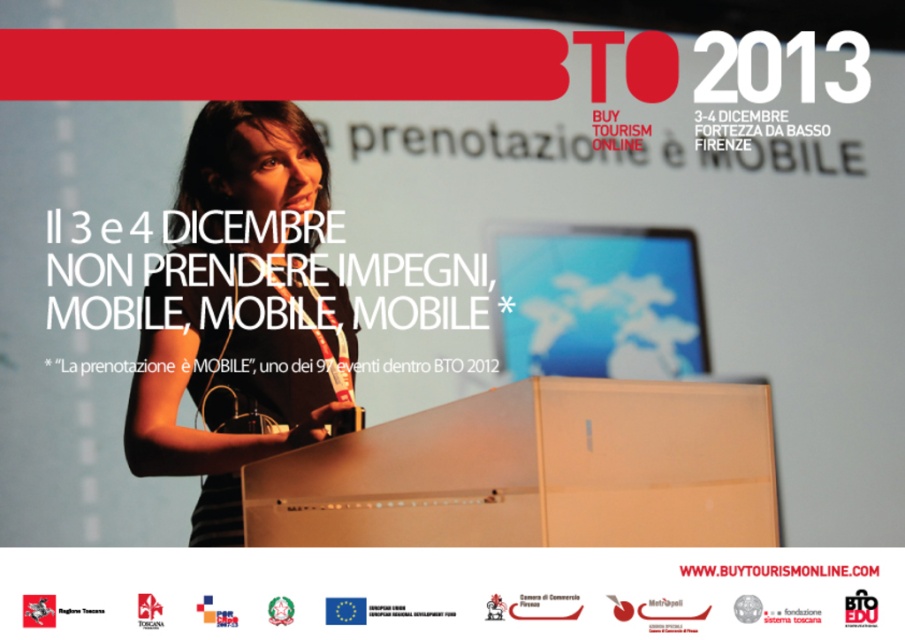
Measure the distance from white glossy podium at center to white glossy website at upper center.

white glossy podium at center and white glossy website at upper center are 17.26 inches apart from each other.

Does white glossy podium at center appear under white glossy website at upper center?

Actually, white glossy podium at center is above white glossy website at upper center.

What do you see at coordinates (534, 472) in the screenshot?
I see `white glossy podium at center` at bounding box center [534, 472].

Locate an element on the screen. This screenshot has width=905, height=640. white glossy podium at center is located at coordinates (534, 472).

Does white paper at upper center have a larger size compared to white glossy website at upper center?

Incorrect, white paper at upper center is not larger than white glossy website at upper center.

Where is `white paper at upper center`? white paper at upper center is located at coordinates (792, 616).

Image resolution: width=905 pixels, height=640 pixels. What are the coordinates of `white paper at upper center` in the screenshot? It's located at (792, 616).

I want to click on white paper at upper center, so click(792, 616).

Is white glossy podium at center taller than matte black laptop at upper center?

No.

Who is positioned more to the right, white glossy podium at center or matte black laptop at upper center?

From the viewer's perspective, white glossy podium at center appears more on the right side.

Identify the location of white glossy podium at center. The image size is (905, 640). (534, 472).